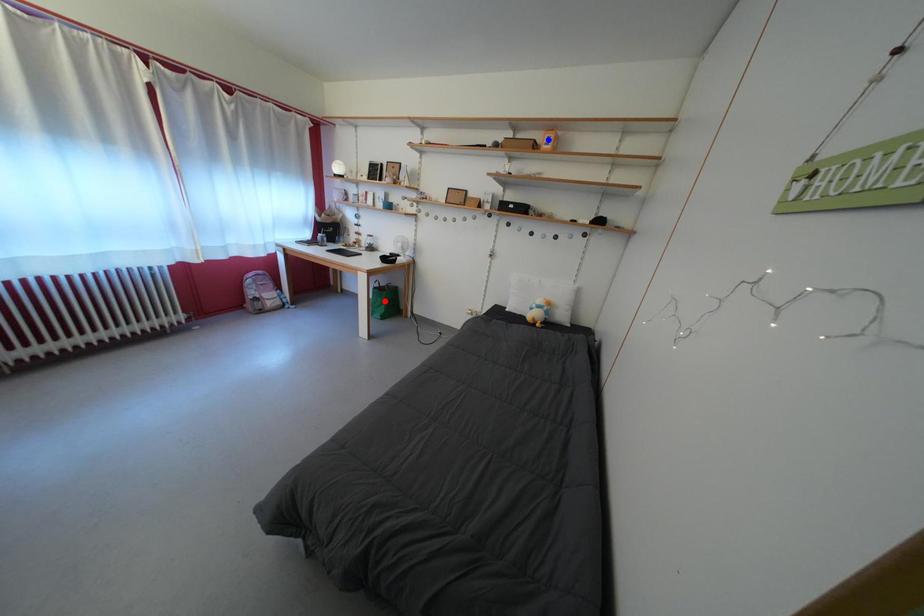
Question: In the image, two points are highlighted. Which point is nearer to the camera? Reply with the corresponding letter.

Choices:
 (A) blue point
 (B) red point

Answer: (A)